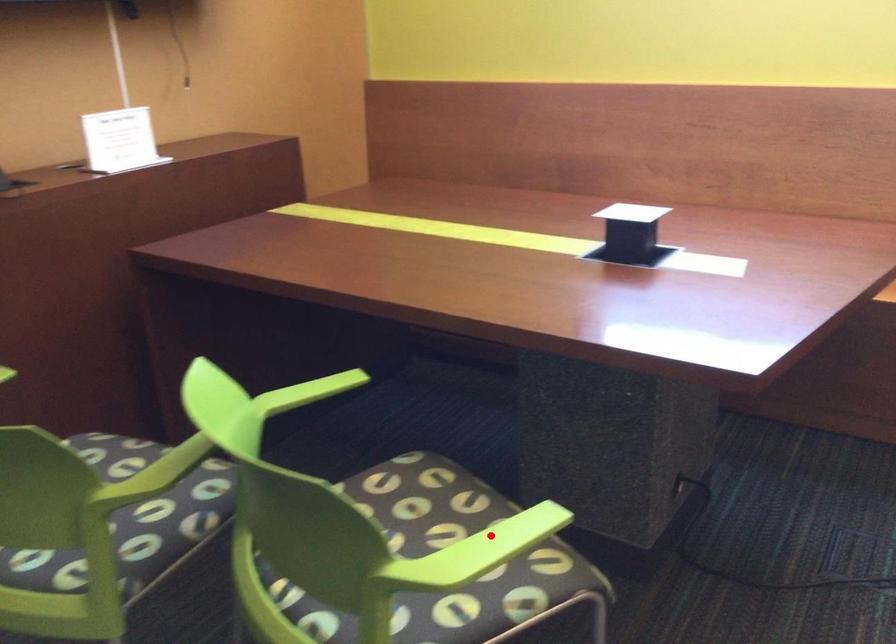
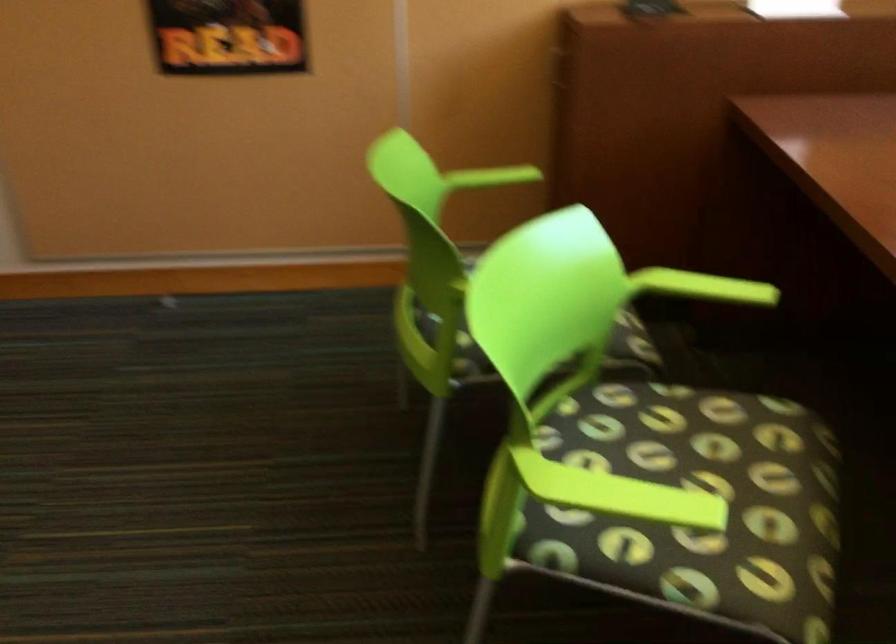
In the second image, find the point that corresponds to the highlighted location in the first image.

(619, 494)